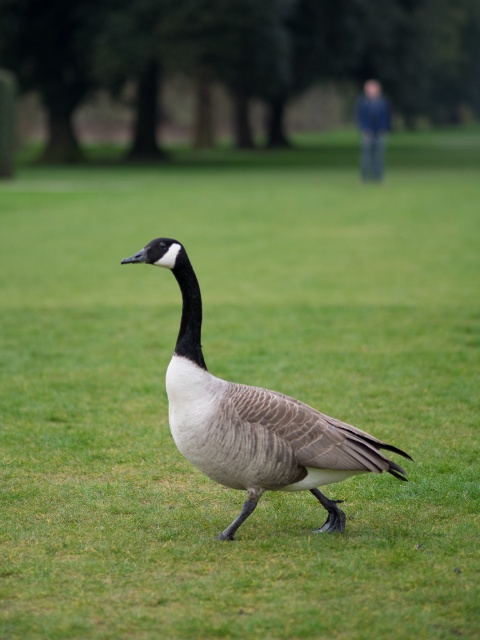
You are a photographer trying to capture the Canada goose in the foreground. There is a gray feathered duck at center marked by point (252,419). To ensure the goose remains the main focus, where should you position your camera focus point relative to the duck?

The gray feathered duck at center is represented by point (252,419). To keep the Canada goose in the foreground as the main focus, position the camera focus point closer to the goose and away from the duck at (252,419).

You are a photographer aiming to capture a closeup of the gray feathered duck at center without the blue fabric man at upper right appearing in the shot. Is this possible given their positions?

The gray feathered duck at center is in front of the blue fabric man at upper right, so the duck will block the man from view. Therefore, you can take a closeup of the gray feathered duck at center without the blue fabric man at upper right appearing in the shot.

You are a photographer trying to capture a closeup of the Canada goose in the foreground. You notice the gray feathered duck at center and the blue fabric man at upper right in your frame. Which object is bigger in your photo?

The gray feathered duck at center is larger in size than the blue fabric man at upper right, so the gray feathered duck at center appears bigger in the photo.